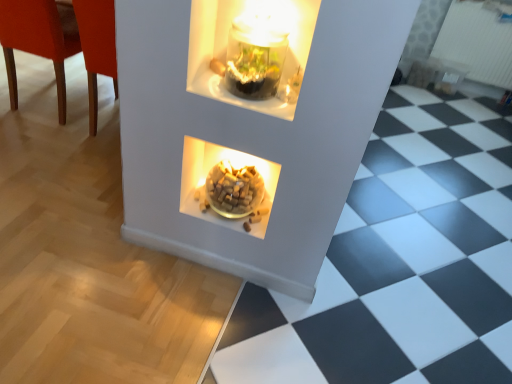
Question: Is white textured radiator at upper right surrounded by matte wood chair at left?

Choices:
 (A) no
 (B) yes

Answer: (A)

Question: Is matte wood chair at left placed right next to white textured radiator at upper right?

Choices:
 (A) yes
 (B) no

Answer: (B)

Question: Does matte wood chair at left have a lesser height compared to white textured radiator at upper right?

Choices:
 (A) yes
 (B) no

Answer: (A)

Question: Can you confirm if matte wood chair at left is smaller than white textured radiator at upper right?

Choices:
 (A) yes
 (B) no

Answer: (B)

Question: Is matte wood chair at left taller than white textured radiator at upper right?

Choices:
 (A) yes
 (B) no

Answer: (B)

Question: In terms of size, does matte wood chair at left appear bigger or smaller than white textured radiator at upper right?

Choices:
 (A) big
 (B) small

Answer: (A)

Question: Is matte wood chair at left wider or thinner than white textured radiator at upper right?

Choices:
 (A) thin
 (B) wide

Answer: (B)

Question: In the image, is matte wood chair at left positioned in front of or behind white textured radiator at upper right?

Choices:
 (A) behind
 (B) front

Answer: (B)

Question: In the image, is matte wood chair at left on the left side or the right side of white textured radiator at upper right?

Choices:
 (A) right
 (B) left

Answer: (B)

Question: Considering the positions of translucent glass bowl at center and white textured radiator at upper right in the image, is translucent glass bowl at center wider or thinner than white textured radiator at upper right?

Choices:
 (A) wide
 (B) thin

Answer: (A)

Question: Would you say translucent glass bowl at center is inside or outside white textured radiator at upper right?

Choices:
 (A) inside
 (B) outside

Answer: (B)

Question: Considering the relative positions of translucent glass bowl at center and white textured radiator at upper right in the image provided, is translucent glass bowl at center to the left or to the right of white textured radiator at upper right?

Choices:
 (A) right
 (B) left

Answer: (B)

Question: Considering the positions of translucent glass bowl at center and white textured radiator at upper right in the image, is translucent glass bowl at center taller or shorter than white textured radiator at upper right?

Choices:
 (A) short
 (B) tall

Answer: (A)

Question: Considering their positions, is translucent glass bowl at center located in front of or behind matte wood chair at left?

Choices:
 (A) behind
 (B) front

Answer: (B)

Question: From the image's perspective, relative to matte wood chair at left, is translucent glass bowl at center above or below?

Choices:
 (A) above
 (B) below

Answer: (B)